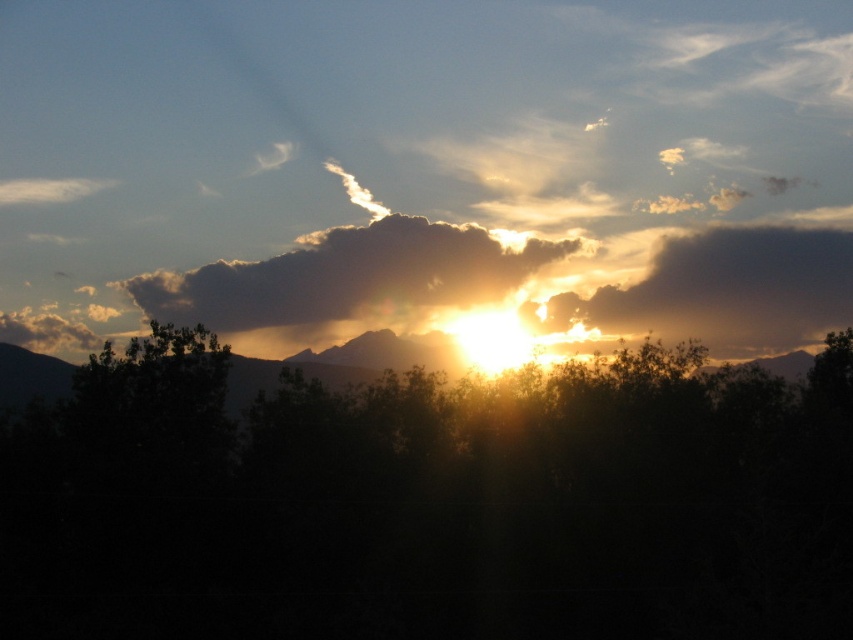
Does point (347, 563) come behind point (270, 268)?

No, (347, 563) is in front of (270, 268).

Does green leafy tree at center have a larger size compared to golden translucent cloud at center?

Correct, green leafy tree at center is larger in size than golden translucent cloud at center.

In order to click on green leafy tree at center in this screenshot , I will do `click(431, 502)`.

You are a GUI agent. You are given a task and a screenshot of the screen. Output one action in this format:
    pyautogui.click(x=<x>, y=<y>)
    Task: Click on the green leafy tree at center
    
    Given the screenshot: What is the action you would take?
    431,502

Who is higher up, green leafy tree at center or golden translucent cloud at upper right?

golden translucent cloud at upper right is above.

Image resolution: width=853 pixels, height=640 pixels. I want to click on green leafy tree at center, so click(431, 502).

Between point (437, 284) and point (704, 285), which one is positioned in front?

Point (437, 284)

This screenshot has height=640, width=853. I want to click on golden translucent cloud at center, so click(347, 276).